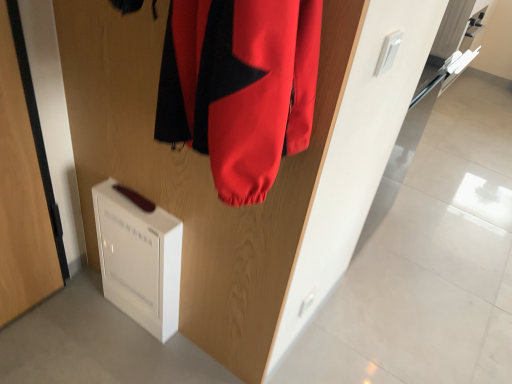
Identify the location of vacant space to the left of wooden door at center, placed as the 1th door when sorted from right to left. This screenshot has width=512, height=384. (89, 322).